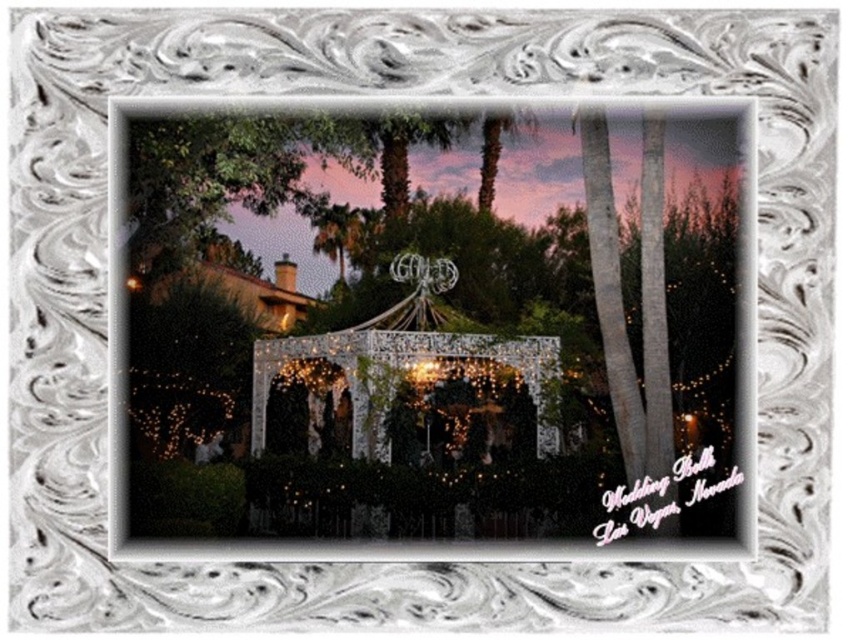
You are a photographer planning to capture the wedding ceremony. You notice two gazebo structures in the scene. Which one is positioned higher in the image, the white lace gazebo at center or the ivory lace gazebo at center?

The white lace gazebo at center is positioned higher than the ivory lace gazebo at center in the image.

You are a photographer at the wedding venue and want to capture the white lace gazebo at center and the ivory lace gazebo at center in a single shot. Which gazebo should you focus on to ensure both are visible without zooming in too much?

The white lace gazebo at center is larger in size compared to the ivory lace gazebo at center, so focusing on the white lace gazebo at center would allow both to be visible without excessive zooming.